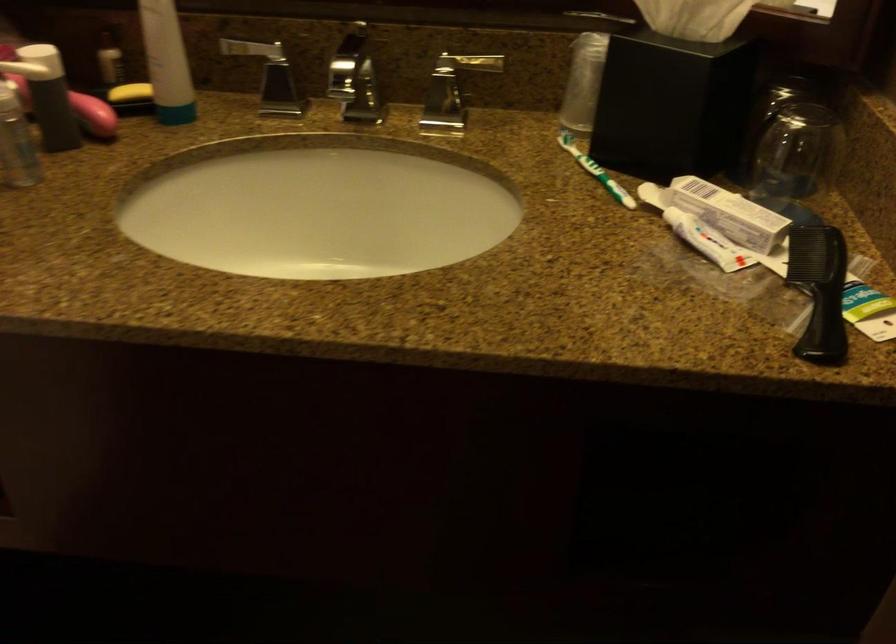
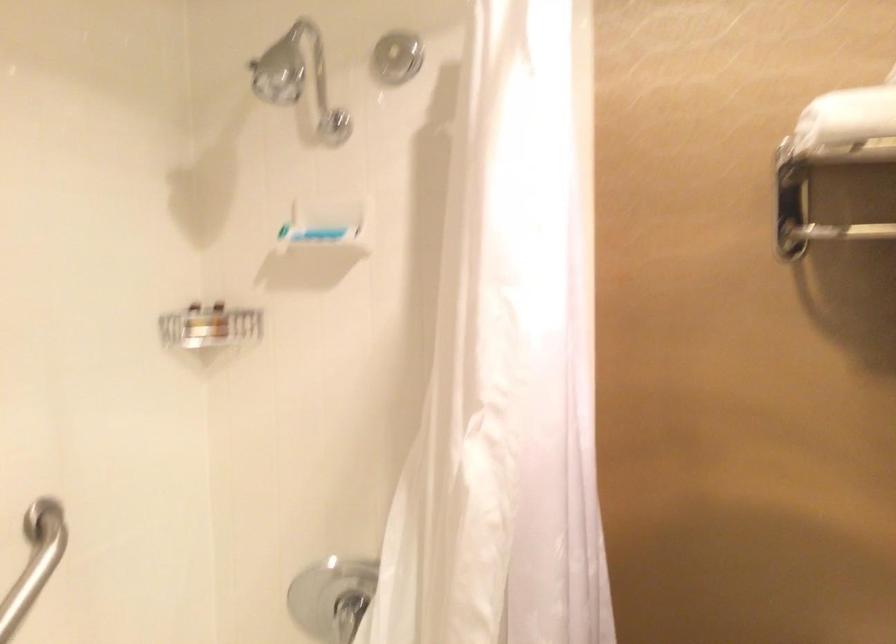
Question: How did the camera likely rotate?

Choices:
 (A) Left
 (B) Right
 (C) Up
 (D) Down

Answer: (A)